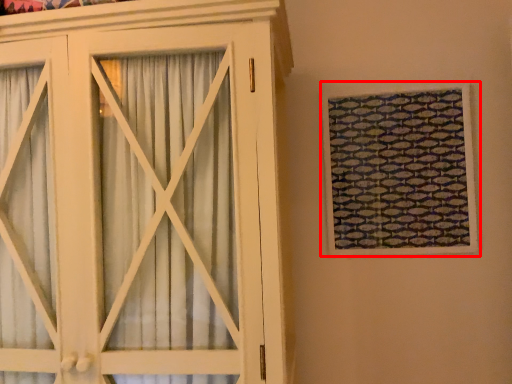
Question: From the image's perspective, where is window (annotated by the red box) located relative to cupboard?

Choices:
 (A) above
 (B) below

Answer: (A)